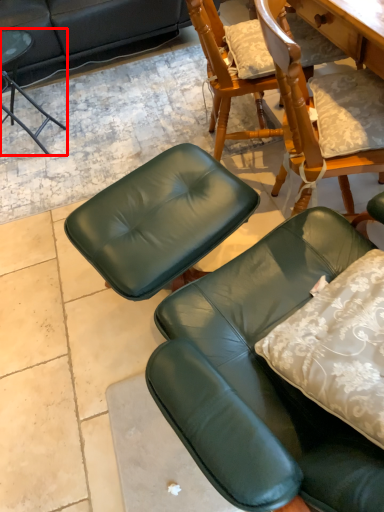
Question: From the image's perspective, where is chair (annotated by the red box) located in relation to chair in the image?

Choices:
 (A) above
 (B) below

Answer: (A)